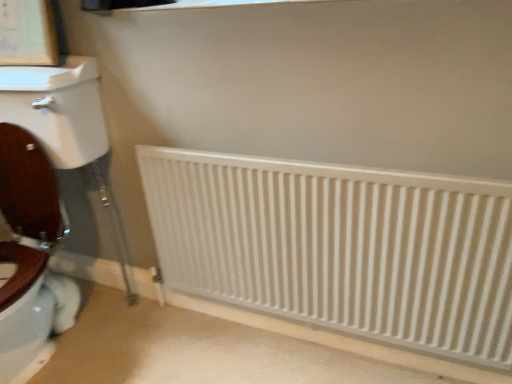
Locate an element on the screen. vacant space in white matte radiator at lower center (from a real-world perspective) is located at coordinates (303, 340).